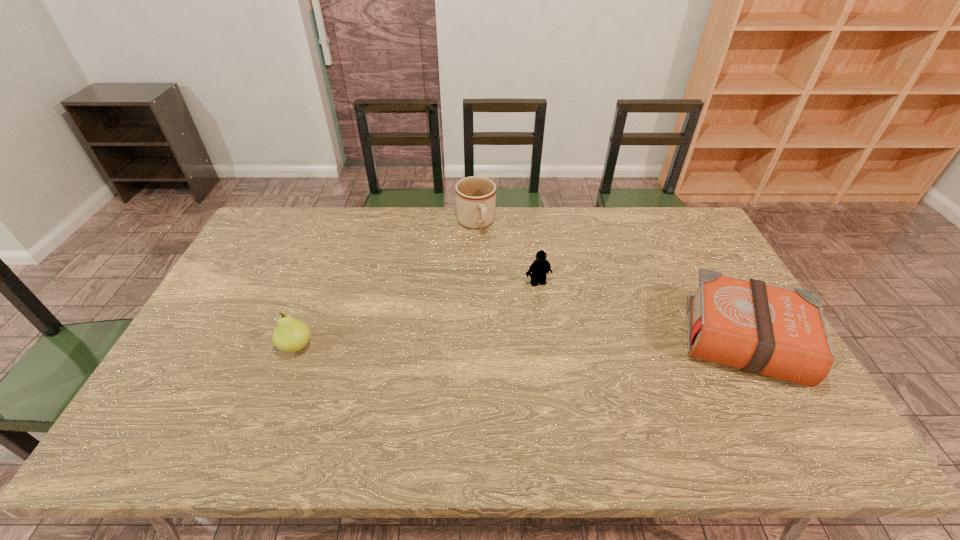
The height and width of the screenshot is (540, 960). Identify the location of free space on the desktop that is between the pear and the Bible and is positioned on the side of the mug with the handle. (525, 343).

Identify the location of free space on the desktop that is between the leftmost object and the rightmost object and is positioned on the face of the Lego. This screenshot has height=540, width=960. (567, 343).